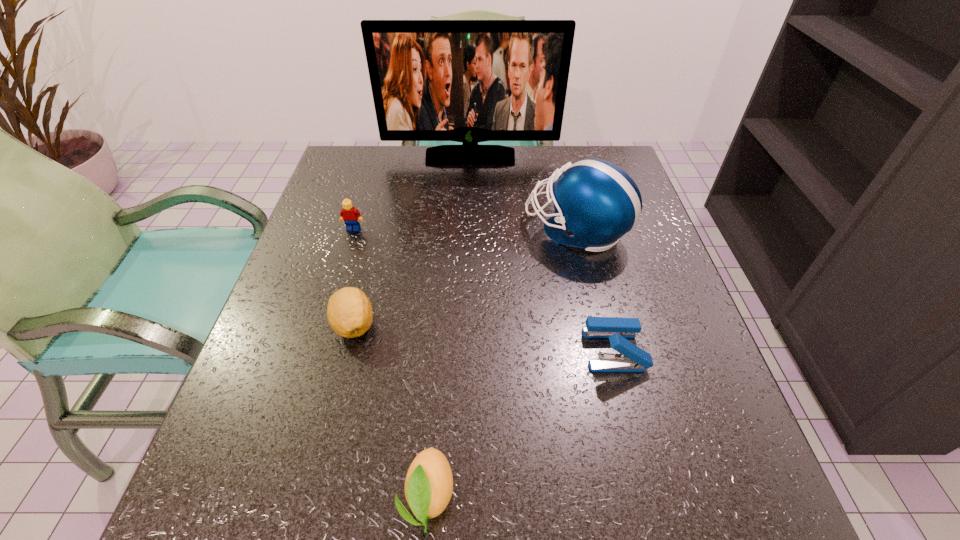
In order to click on vacant region located 0.090m on the front-facing side of the Lego in this screenshot , I will do `click(345, 259)`.

Locate an element on the screen. This screenshot has height=540, width=960. vacant space located on the front of the stapler is located at coordinates (644, 467).

Locate an element on the screen. vacant space situated at the stem end of the left lemon is located at coordinates coord(334,405).

Image resolution: width=960 pixels, height=540 pixels. Identify the location of object present at the far edge. (469, 81).

Locate an element on the screen. The width and height of the screenshot is (960, 540). monitor that is at the left edge is located at coordinates (469, 81).

You are a GUI agent. You are given a task and a screenshot of the screen. Output one action in this format:
    pyautogui.click(x=<x>, y=<y>)
    Task: Click on the Lego that is at the left edge
    The width and height of the screenshot is (960, 540).
    Given the screenshot: What is the action you would take?
    pyautogui.click(x=351, y=216)

Locate an element on the screen. The image size is (960, 540). lemon located at the left edge is located at coordinates (349, 312).

At what (x,y) coordinates should I click in order to perform the action: click on football helmet located in the right edge section of the desktop. Please return your answer as a coordinate pair (x, y). The height and width of the screenshot is (540, 960). Looking at the image, I should click on (596, 202).

You are a GUI agent. You are given a task and a screenshot of the screen. Output one action in this format:
    pyautogui.click(x=<x>, y=<y>)
    Task: Click on the stapler present at the right edge
    
    Given the screenshot: What is the action you would take?
    pyautogui.click(x=631, y=358)

This screenshot has height=540, width=960. Find the location of `object that is at the far left corner`. object that is at the far left corner is located at coordinates (469, 81).